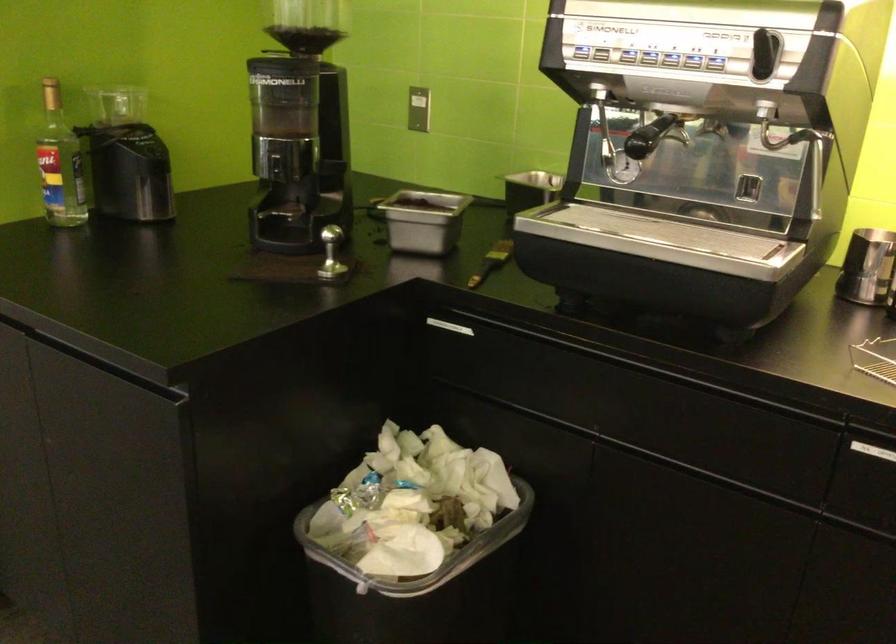
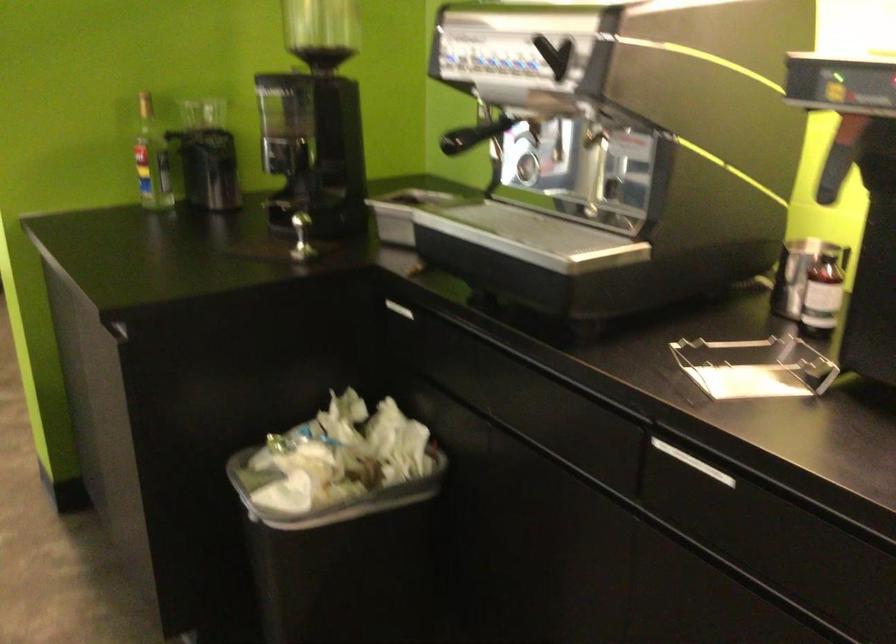
Find the pixel in the second image that matches point (814, 172) in the first image.

(592, 171)